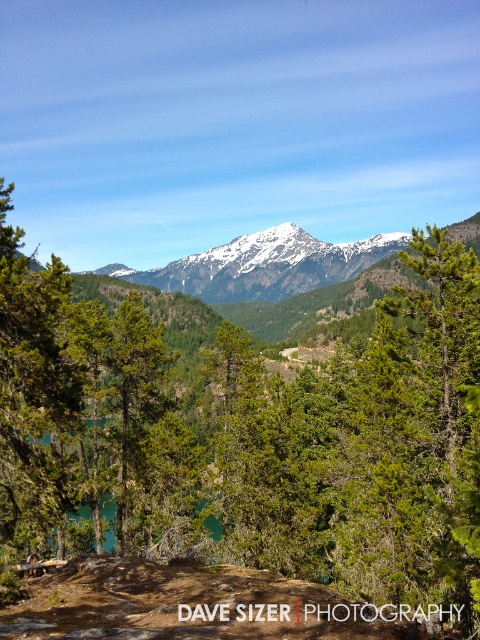
Question: Considering the real-world distances, which object is farthest from the teal glass lake at center?

Choices:
 (A) green matte tree at left
 (B) green matte tree at center

Answer: (B)

Question: Which point is farther to the camera?

Choices:
 (A) green leafy tree at center
 (B) teal glass lake at center
 (C) white snow-covered mountain range at center

Answer: (C)

Question: Does green matte tree at left appear under white snow-covered mountain range at center?

Choices:
 (A) no
 (B) yes

Answer: (B)

Question: Can you confirm if green leafy tree at center is bigger than white snow-covered mountain range at center?

Choices:
 (A) yes
 (B) no

Answer: (B)

Question: Is green matte tree at left thinner than green matte tree at center?

Choices:
 (A) yes
 (B) no

Answer: (A)

Question: Based on their relative distances, which object is farther from the white snow-covered mountain range at center?

Choices:
 (A) green leafy tree at center
 (B) green matte tree at center
 (C) teal glass lake at center

Answer: (C)